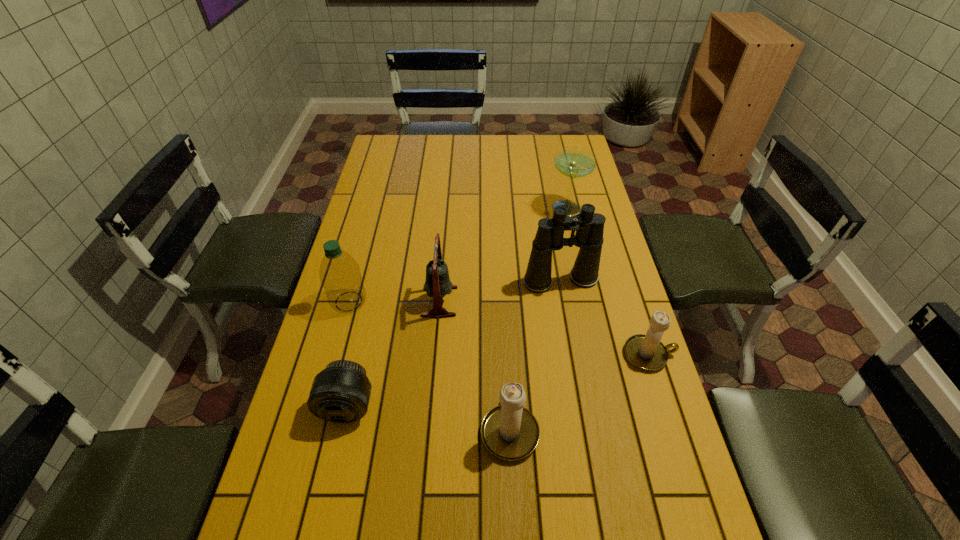
Identify the location of the left candle holder. This screenshot has height=540, width=960. (510, 432).

At what (x,y) coordinates should I click in order to perform the action: click on the nearer candle holder. Please return your answer as a coordinate pair (x, y). This screenshot has height=540, width=960. Looking at the image, I should click on (510, 432).

The image size is (960, 540). I want to click on the shorter candle holder, so click(x=646, y=352).

The image size is (960, 540). What are the coordinates of `the second shortest object` in the screenshot? It's located at (646, 352).

Find the location of a particular element. Image resolution: width=960 pixels, height=540 pixels. martini is located at coordinates (574, 162).

Where is `water bottle`? This screenshot has width=960, height=540. water bottle is located at coordinates (340, 275).

The height and width of the screenshot is (540, 960). In order to click on bell in this screenshot , I will do `click(437, 284)`.

Find the location of a particular element. The image size is (960, 540). binoculars is located at coordinates click(x=589, y=226).

Locate an element on the screen. telephoto lens is located at coordinates (340, 393).

Identify the location of vacant region located 0.140m on the handle side of the left candle holder. (506, 350).